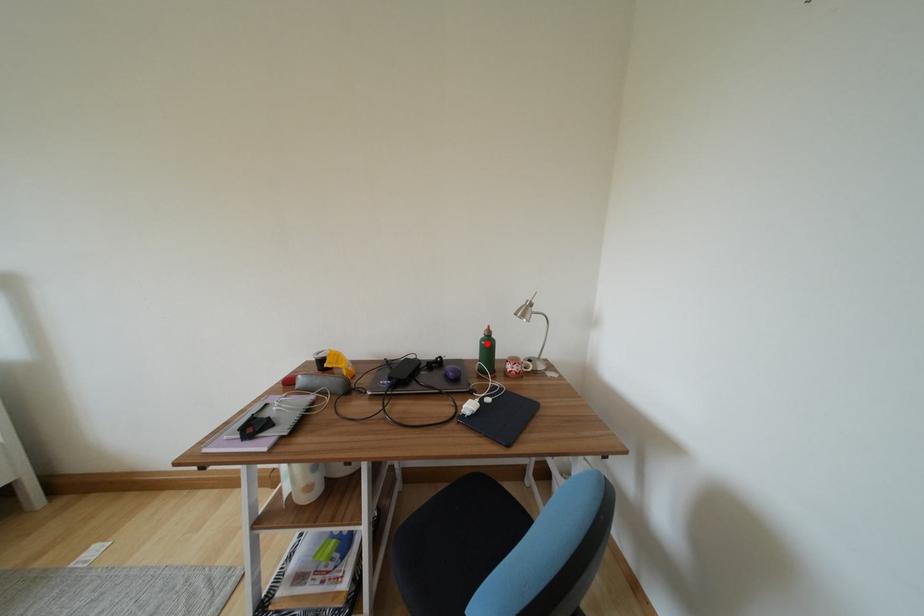
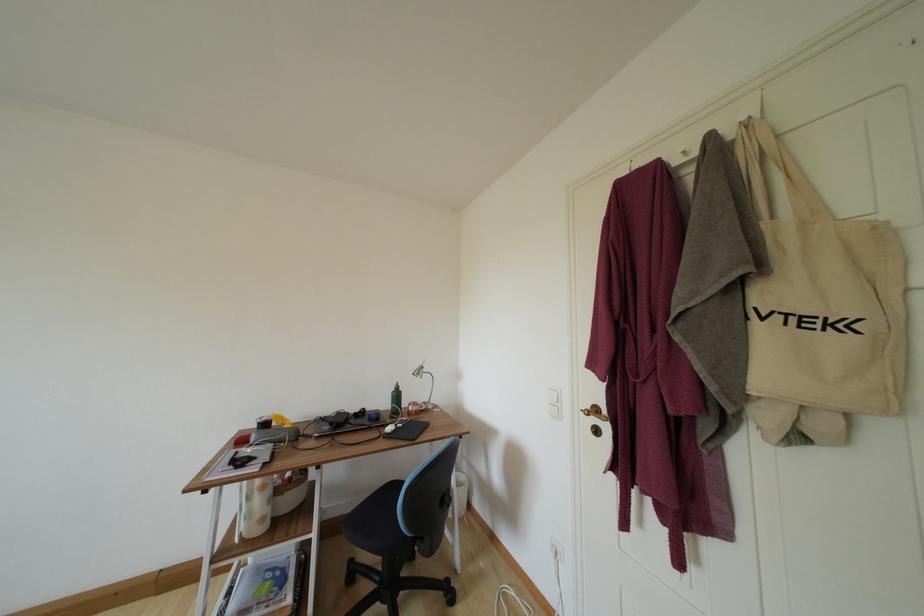
Where in the second image is the point corresponding to the highlighted location from the first image?

(398, 395)